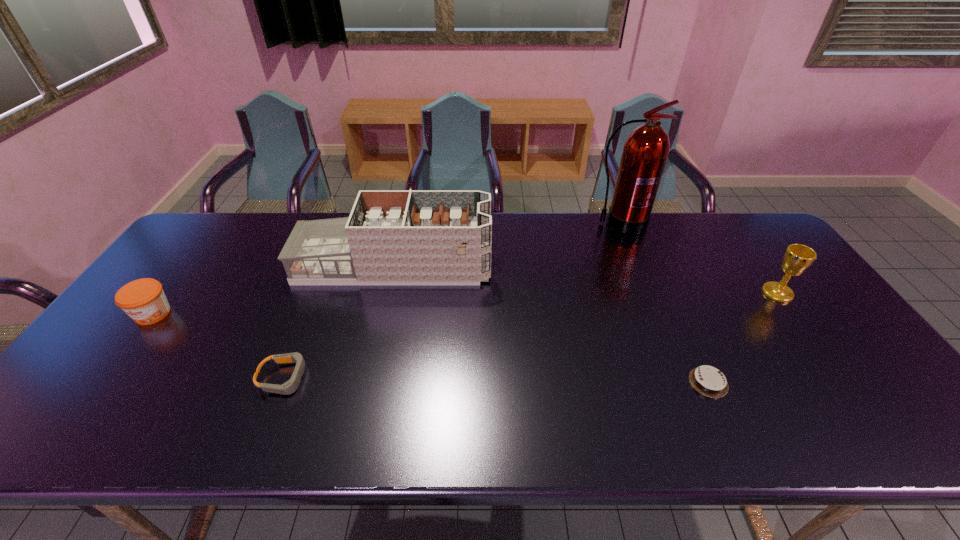
The height and width of the screenshot is (540, 960). Identify the location of free space that satisfies the following two spatial constraints: 1. on the back side of the rightmost object; 2. on the right side of the chocolate cake. (668, 293).

Locate an element on the screen. vacant space that satisfies the following two spatial constraints: 1. on the back side of the chalice; 2. at the entrance of the dollhouse is located at coordinates click(758, 266).

You are a GUI agent. You are given a task and a screenshot of the screen. Output one action in this format:
    pyautogui.click(x=<x>, y=<y>)
    Task: Click on the vacant region that satisfies the following two spatial constraints: 1. on the front and back of the chocolate cake; 2. on the right side of the fifth tallest object
    The image size is (960, 540).
    Given the screenshot: What is the action you would take?
    pyautogui.click(x=283, y=382)

The width and height of the screenshot is (960, 540). Identify the location of free space that satisfies the following two spatial constraints: 1. on the front-facing side of the shortest object; 2. on the right side of the tallest object. (683, 382).

Where is `free spot that satisfies the following two spatial constraints: 1. on the front-facing side of the tallest object; 2. at the entrance of the dollhouse`? free spot that satisfies the following two spatial constraints: 1. on the front-facing side of the tallest object; 2. at the entrance of the dollhouse is located at coordinates (636, 266).

Locate an element on the screen. The image size is (960, 540). free space that satisfies the following two spatial constraints: 1. at the entrance of the dollhouse; 2. on the right side of the chalice is located at coordinates (388, 293).

Find the location of `free location that satisfies the following two spatial constraints: 1. at the entrance of the shortest object; 2. on the right side of the dollhouse`. free location that satisfies the following two spatial constraints: 1. at the entrance of the shortest object; 2. on the right side of the dollhouse is located at coordinates tap(368, 382).